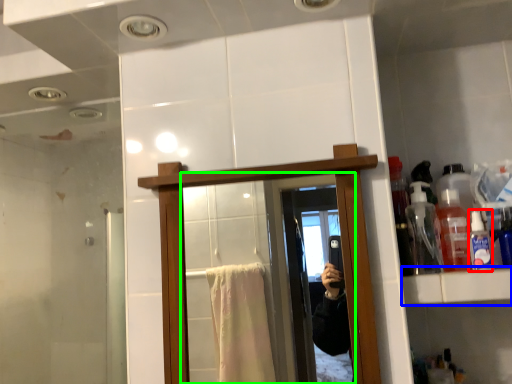
Question: Considering the real-world distances, which object is closest to toiletry (highlighted by a red box)? cabinet (highlighted by a blue box) or mirror (highlighted by a green box).

Choices:
 (A) cabinet
 (B) mirror

Answer: (A)